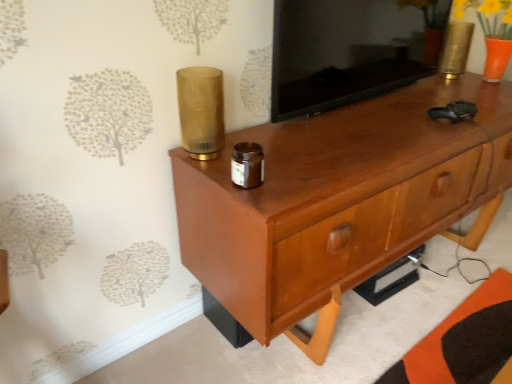
What is the approximate width of matte wood tv cabinet at upper center?

matte wood tv cabinet at upper center is 3.03 inches in width.

The image size is (512, 384). What do you see at coordinates (201, 111) in the screenshot?
I see `translucent amber glass at upper center, positioned as the first candle holder in left-to-right order` at bounding box center [201, 111].

In order to click on matte wood tv cabinet at upper center in this screenshot , I will do `click(350, 50)`.

Is matte wood tv cabinet at upper center inside translucent amber glass at upper center, the first candle holder in the bottom-to-top sequence?

No.

From a real-world perspective, is translucent amber glass at upper center, the second candle holder when ordered from top to bottom, over matte wood tv cabinet at upper center?

No, from a real-world perspective, translucent amber glass at upper center, the second candle holder when ordered from top to bottom, is not above matte wood tv cabinet at upper center.

How far apart are translucent amber glass at upper center, arranged as the first candle holder when viewed from the front, and matte wood tv cabinet at upper center?

translucent amber glass at upper center, arranged as the first candle holder when viewed from the front, is 17.96 inches from matte wood tv cabinet at upper center.

Is translucent amber glass at upper center, the second candle holder when ordered from top to bottom, shorter than matte wood tv cabinet at upper center?

Correct, translucent amber glass at upper center, the second candle holder when ordered from top to bottom, is not as tall as matte wood tv cabinet at upper center.

Considering the relative sizes of glossy wood chest of drawers at center and translucent amber glass at upper center, positioned as the first candle holder in left-to-right order, in the image provided, is glossy wood chest of drawers at center smaller than translucent amber glass at upper center, positioned as the first candle holder in left-to-right order,?

No, glossy wood chest of drawers at center is not smaller than translucent amber glass at upper center, positioned as the first candle holder in left-to-right order.

From the image's perspective, is glossy wood chest of drawers at center located above or below translucent amber glass at upper center, positioned as the first candle holder in left-to-right order?

Based on their image positions, glossy wood chest of drawers at center is located beneath translucent amber glass at upper center, positioned as the first candle holder in left-to-right order.

Which object is closer to the camera, glossy wood chest of drawers at center or translucent amber glass at upper center, the first candle holder in the bottom-to-top sequence?

glossy wood chest of drawers at center is in front.

Is point (429, 189) behind point (215, 99)?

Yes, it is behind point (215, 99).

You are a GUI agent. You are given a task and a screenshot of the screen. Output one action in this format:
    pyautogui.click(x=<x>, y=<y>)
    Task: Click on the candle holder that is on the right side of translucent amber glass at upper center, the second candle holder when ordered from top to bottom
    Image resolution: width=512 pixels, height=384 pixels.
    Given the screenshot: What is the action you would take?
    pyautogui.click(x=455, y=49)

Considering the positions of objects gold metallic vase at upper right, the 2th candle holder positioned from the bottom, and translucent amber glass at upper center, positioned as the first candle holder in left-to-right order, in the image provided, who is behind, gold metallic vase at upper right, the 2th candle holder positioned from the bottom, or translucent amber glass at upper center, positioned as the first candle holder in left-to-right order,?

gold metallic vase at upper right, the 2th candle holder positioned from the bottom.

From the picture: Is gold metallic vase at upper right, the 2th candle holder positioned from the bottom, next to translucent amber glass at upper center, the first candle holder in the bottom-to-top sequence, and touching it?

No, gold metallic vase at upper right, the 2th candle holder positioned from the bottom, is not touching translucent amber glass at upper center, the first candle holder in the bottom-to-top sequence.

Is gold metallic vase at upper right, the first candle holder viewed from the right, taller or shorter than translucent amber glass at upper center, arranged as the first candle holder when viewed from the front?

Clearly, gold metallic vase at upper right, the first candle holder viewed from the right, is shorter compared to translucent amber glass at upper center, arranged as the first candle holder when viewed from the front.

Is point (447, 45) positioned before point (406, 106)?

No, it is not.

Is gold metallic vase at upper right, the 2th candle holder from the front, bigger than glossy wood chest of drawers at center?

No.

From a real-world perspective, is gold metallic vase at upper right, acting as the 2th candle holder starting from the left, located higher than glossy wood chest of drawers at center?

Yes, from a real-world perspective, gold metallic vase at upper right, acting as the 2th candle holder starting from the left, is over glossy wood chest of drawers at center

Which object is positioned more to the left, gold metallic vase at upper right, the 2th candle holder positioned from the bottom, or glossy wood chest of drawers at center?

glossy wood chest of drawers at center.

Is gold metallic vase at upper right, placed as the 1th candle holder when sorted from top to bottom, at the left side of matte wood tv cabinet at upper center?

No, gold metallic vase at upper right, placed as the 1th candle holder when sorted from top to bottom, is not to the left of matte wood tv cabinet at upper center.

Considering their positions, is gold metallic vase at upper right, the 1th candle holder viewed from the back, located in front of or behind matte wood tv cabinet at upper center?

Visually, gold metallic vase at upper right, the 1th candle holder viewed from the back, is located behind matte wood tv cabinet at upper center.

From the picture: From the image's perspective, is gold metallic vase at upper right, the first candle holder viewed from the right, positioned above or below matte wood tv cabinet at upper center?

Clearly, from the image's perspective, gold metallic vase at upper right, the first candle holder viewed from the right, is above matte wood tv cabinet at upper center.

Considering the points (203, 112) and (220, 254), which point is in front, point (203, 112) or point (220, 254)?

The point (220, 254) is closer.

Is translucent amber glass at upper center, positioned as the first candle holder in left-to-right order, positioned beyond the bounds of glossy wood chest of drawers at center?

Yes.

Does translucent amber glass at upper center, the first candle holder in the bottom-to-top sequence, touch glossy wood chest of drawers at center?

translucent amber glass at upper center, the first candle holder in the bottom-to-top sequence, and glossy wood chest of drawers at center are clearly separated.

Is translucent amber glass at upper center, the second candle holder when ordered from top to bottom, to the left or to the right of glossy wood chest of drawers at center in the image?

In the image, translucent amber glass at upper center, the second candle holder when ordered from top to bottom, appears on the left side of glossy wood chest of drawers at center.

From a real-world perspective, which is physically above, matte wood tv cabinet at upper center or translucent amber glass at upper center, positioned as the first candle holder in left-to-right order?

From a 3D spatial view, matte wood tv cabinet at upper center is above.

Is there a large distance between matte wood tv cabinet at upper center and translucent amber glass at upper center, the second candle holder when ordered from top to bottom?

Actually, matte wood tv cabinet at upper center and translucent amber glass at upper center, the second candle holder when ordered from top to bottom, are a little close together.

Can you confirm if matte wood tv cabinet at upper center is taller than translucent amber glass at upper center, placed as the 2th candle holder when sorted from back to front?

Indeed, matte wood tv cabinet at upper center has a greater height compared to translucent amber glass at upper center, placed as the 2th candle holder when sorted from back to front.

Can you confirm if matte wood tv cabinet at upper center is smaller than translucent amber glass at upper center, the first candle holder in the bottom-to-top sequence?

No, matte wood tv cabinet at upper center is not smaller than translucent amber glass at upper center, the first candle holder in the bottom-to-top sequence.

Find the location of a particular element. tv cabinet located above the translucent amber glass at upper center, positioned as the first candle holder in left-to-right order (from the image's perspective) is located at coordinates (350, 50).

Image resolution: width=512 pixels, height=384 pixels. Identify the location of candle holder on the left side of glossy wood chest of drawers at center. (201, 111).

Which object lies further to the anchor point translucent amber glass at upper center, the second candle holder when ordered from top to bottom, matte wood tv cabinet at upper center or glossy wood chest of drawers at center?

Among the two, matte wood tv cabinet at upper center is located further to translucent amber glass at upper center, the second candle holder when ordered from top to bottom.

Estimate the real-world distances between objects in this image. Which object is further from glossy wood chest of drawers at center, gold metallic vase at upper right, the 1th candle holder viewed from the back, or matte wood tv cabinet at upper center?

Among the two, gold metallic vase at upper right, the 1th candle holder viewed from the back, is located further to glossy wood chest of drawers at center.

From the image, which object appears to be nearer to translucent amber glass at upper center, positioned as the 2th candle holder in right-to-left order, glossy wood chest of drawers at center or matte wood tv cabinet at upper center?

The object closer to translucent amber glass at upper center, positioned as the 2th candle holder in right-to-left order, is glossy wood chest of drawers at center.

When comparing their distances from glossy wood chest of drawers at center, does translucent amber glass at upper center, the first candle holder in the bottom-to-top sequence, or matte wood tv cabinet at upper center seem further?

translucent amber glass at upper center, the first candle holder in the bottom-to-top sequence.

From the image, which object appears to be farther from gold metallic vase at upper right, the 2th candle holder from the front, glossy wood chest of drawers at center or matte wood tv cabinet at upper center?

The object further to gold metallic vase at upper right, the 2th candle holder from the front, is glossy wood chest of drawers at center.

Which object lies further to the anchor point glossy wood chest of drawers at center, matte wood tv cabinet at upper center or translucent amber glass at upper center, positioned as the 2th candle holder in right-to-left order?

Among the two, translucent amber glass at upper center, positioned as the 2th candle holder in right-to-left order, is located further to glossy wood chest of drawers at center.

Based on their spatial positions, is translucent amber glass at upper center, arranged as the first candle holder when viewed from the front, or glossy wood chest of drawers at center further from gold metallic vase at upper right, the 2th candle holder from the front?

Based on the image, translucent amber glass at upper center, arranged as the first candle holder when viewed from the front, appears to be further to gold metallic vase at upper right, the 2th candle holder from the front.

When comparing their distances from gold metallic vase at upper right, the first candle holder viewed from the right, does matte wood tv cabinet at upper center or glossy wood chest of drawers at center seem closer?

matte wood tv cabinet at upper center lies closer to gold metallic vase at upper right, the first candle holder viewed from the right, than the other object.

Where is `tv cabinet between translucent amber glass at upper center, placed as the 2th candle holder when sorted from back to front, and gold metallic vase at upper right, placed as the 1th candle holder when sorted from top to bottom, from left to right`? Image resolution: width=512 pixels, height=384 pixels. tv cabinet between translucent amber glass at upper center, placed as the 2th candle holder when sorted from back to front, and gold metallic vase at upper right, placed as the 1th candle holder when sorted from top to bottom, from left to right is located at coordinates (350, 50).

Identify the location of tv cabinet between translucent amber glass at upper center, positioned as the first candle holder in left-to-right order, and glossy wood chest of drawers at center, in the horizontal direction. (350, 50).

This screenshot has height=384, width=512. Find the location of `chest of drawers between translucent amber glass at upper center, placed as the 2th candle holder when sorted from back to front, and gold metallic vase at upper right, the first candle holder viewed from the right`. chest of drawers between translucent amber glass at upper center, placed as the 2th candle holder when sorted from back to front, and gold metallic vase at upper right, the first candle holder viewed from the right is located at coordinates (337, 201).

Identify the location of tv cabinet between glossy wood chest of drawers at center and gold metallic vase at upper right, the 2th candle holder from the front, from front to back. The width and height of the screenshot is (512, 384). (350, 50).